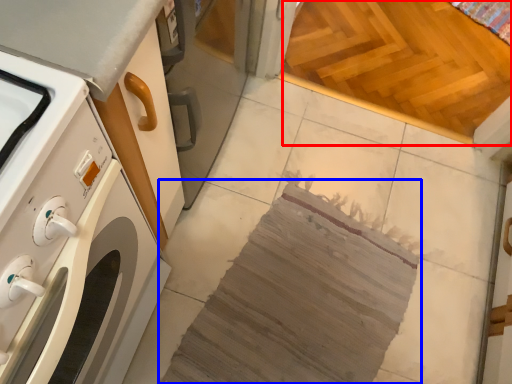
Question: Which point is further to the camera, plywood (highlighted by a red box) or blanket (highlighted by a blue box)?

Choices:
 (A) plywood
 (B) blanket

Answer: (A)